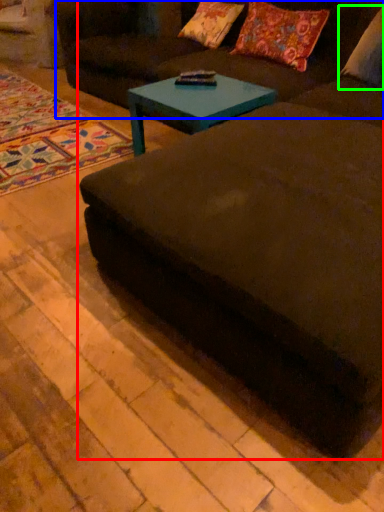
Question: Considering the real-world distances, which object is farthest from studio couch (highlighted by a red box)? couch (highlighted by a blue box) or pillow (highlighted by a green box)?

Choices:
 (A) couch
 (B) pillow

Answer: (A)